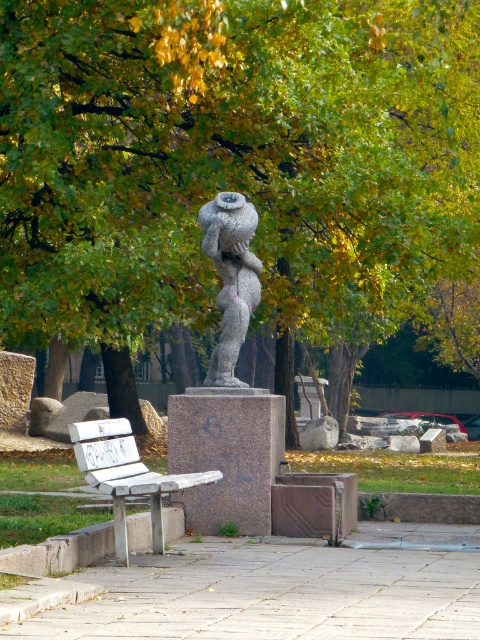
Question: Does granite statue at center appear on the right side of white wood bench at lower left?

Choices:
 (A) no
 (B) yes

Answer: (B)

Question: Which object is farther from the camera taking this photo?

Choices:
 (A) green leafy tree at upper center
 (B) granite statue at center

Answer: (A)

Question: Which of the following is the closest to the observer?

Choices:
 (A) white wood bench at lower left
 (B) green leafy tree at upper center
 (C) granite statue at center

Answer: (A)

Question: Based on their relative distances, which object is farther from the green leafy tree at upper center?

Choices:
 (A) white wood bench at lower left
 (B) granite statue at center

Answer: (A)

Question: Where is green leafy tree at upper center located in relation to white wood bench at lower left in the image?

Choices:
 (A) below
 (B) above

Answer: (B)

Question: From the image, what is the correct spatial relationship of green leafy tree at upper center in relation to white wood bench at lower left?

Choices:
 (A) above
 (B) below

Answer: (A)